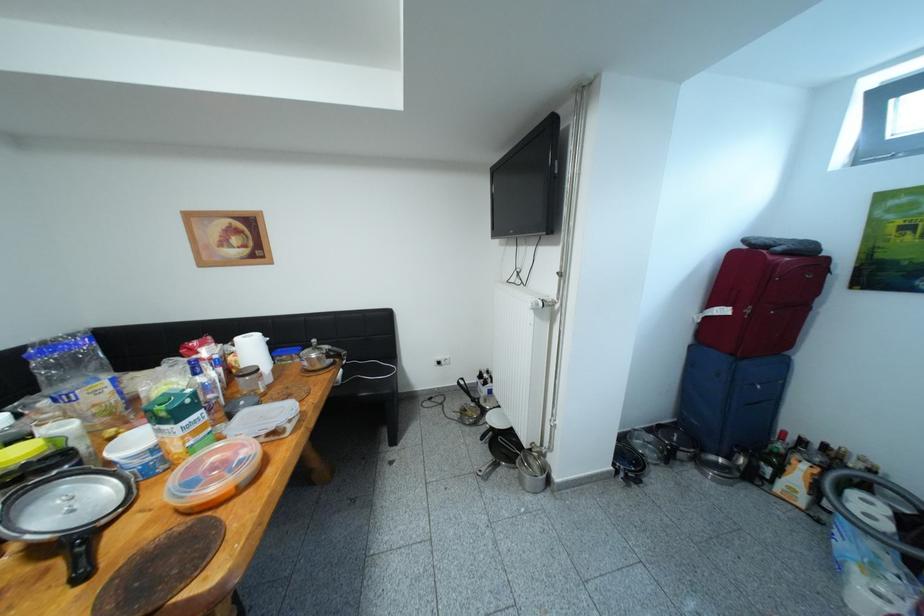
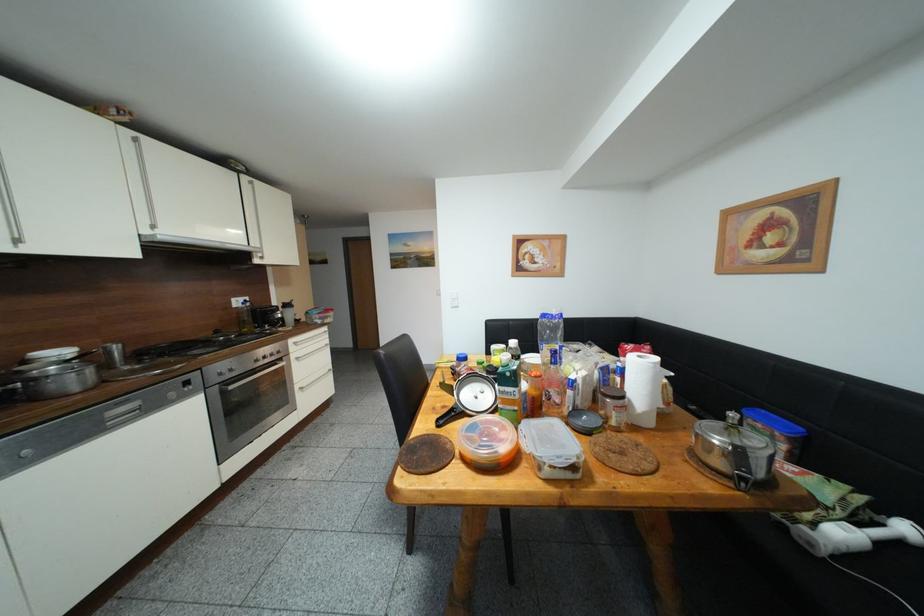
Question: The camera is either moving clockwise (left) or counter-clockwise (right) around the object. The first image is from the beginning of the video and the second image is from the end. Is the camera moving left or right when shooting the video?

Choices:
 (A) Left
 (B) Right

Answer: (B)